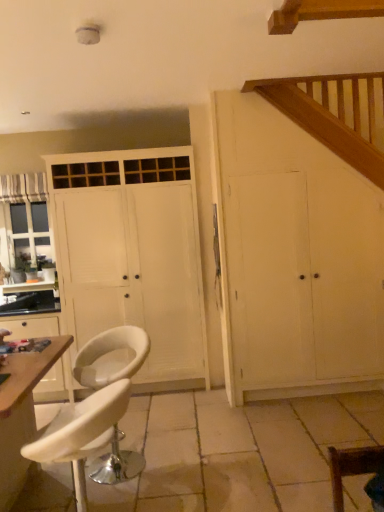
This screenshot has width=384, height=512. What do you see at coordinates (133, 255) in the screenshot?
I see `white matte cabinet at center, which is the 1th cupboard in left-to-right order` at bounding box center [133, 255].

Describe the element at coordinates (81, 433) in the screenshot. I see `white leather stool at lower left, acting as the second chair starting from the back` at that location.

Measure the distance between point (107, 440) and camera.

The distance of point (107, 440) from camera is 1.97 meters.

The image size is (384, 512). What do you see at coordinates (352, 467) in the screenshot?
I see `white leather chair at lower right, which is the 3th chair from left to right` at bounding box center [352, 467].

Locate an element on the screen. This screenshot has width=384, height=512. white wood cupboard at right, the 1th cupboard viewed from the right is located at coordinates (294, 258).

This screenshot has height=512, width=384. What are the coordinates of `matte white cabinet at left` in the screenshot? It's located at click(x=32, y=327).

Looking at this image, measure the distance between point (58, 382) and camera.

The distance of point (58, 382) from camera is 12.72 feet.

This screenshot has height=512, width=384. In order to click on white leather bar stool at lower left, which appears as the first chair when viewed from the left in this screenshot , I will do `click(111, 358)`.

Would you say matte white cabinet at left is to the left or to the right of wooden table at lower left in the picture?

In the image, matte white cabinet at left appears on the left side of wooden table at lower left.

From the image's perspective, is matte white cabinet at left under wooden table at lower left?

No, from the image's perspective, matte white cabinet at left is not below wooden table at lower left.

This screenshot has height=512, width=384. Find the location of `cabinetry above the wooden table at lower left (from a real-world perspective)`. cabinetry above the wooden table at lower left (from a real-world perspective) is located at coordinates (32, 327).

In the image, is matte white cabinet at left positioned in front of or behind wooden table at lower left?

matte white cabinet at left is behind wooden table at lower left.

Considering the sizes of white wood cupboard at right, which ranks as the second cupboard in left-to-right order, and matte white cabinet at left in the image, is white wood cupboard at right, which ranks as the second cupboard in left-to-right order, bigger or smaller than matte white cabinet at left?

Considering their sizes, white wood cupboard at right, which ranks as the second cupboard in left-to-right order, takes up more space than matte white cabinet at left.

Is white wood cupboard at right, the 1th cupboard viewed from the right, oriented towards matte white cabinet at left?

No, white wood cupboard at right, the 1th cupboard viewed from the right, does not turn towards matte white cabinet at left.

In the image, is white wood cupboard at right, the 1th cupboard viewed from the right, positioned in front of or behind matte white cabinet at left?

white wood cupboard at right, the 1th cupboard viewed from the right, is in front of matte white cabinet at left.

Could matte white cabinet at left be considered to be inside white wood cupboard at right, the 1th cupboard viewed from the right?

No, matte white cabinet at left is located outside of white wood cupboard at right, the 1th cupboard viewed from the right.

Based on their sizes in the image, would you say white leather chair at lower right, placed as the 3th chair when sorted from back to front, is bigger or smaller than matte white cabinet at left?

In the image, white leather chair at lower right, placed as the 3th chair when sorted from back to front, appears to be smaller than matte white cabinet at left.

Between white leather chair at lower right, which is the first chair from front to back, and matte white cabinet at left, which one has less height?

white leather chair at lower right, which is the first chair from front to back, is shorter.

What's the angular difference between white leather chair at lower right, which is the first chair from front to back, and matte white cabinet at left's facing directions?

89.5 degrees separate the facing orientations of white leather chair at lower right, which is the first chair from front to back, and matte white cabinet at left.

From the matte white cabinet at left, count 3rd chair to the right and point to it. Please provide its 2D coordinates.

[(352, 467)]

Can you tell me how much white leather bar stool at lower left, arranged as the 1th chair when viewed from the back, and wooden table at lower left differ in facing direction?

The angle between the facing direction of white leather bar stool at lower left, arranged as the 1th chair when viewed from the back, and the facing direction of wooden table at lower left is 121 degrees.

From a real-world perspective, does white leather bar stool at lower left, arranged as the 1th chair when viewed from the back, stand above wooden table at lower left?

No.

From the image's perspective, relative to wooden table at lower left, is white leather bar stool at lower left, arranged as the third chair when viewed from the right, above or below?

Based on their image positions, white leather bar stool at lower left, arranged as the third chair when viewed from the right, is located above wooden table at lower left.

Is white leather bar stool at lower left, arranged as the third chair when viewed from the right, inside the boundaries of wooden table at lower left, or outside?

white leather bar stool at lower left, arranged as the third chair when viewed from the right, is outside wooden table at lower left.

Can you confirm if striped fabric curtain at left is smaller than white leather stool at lower left, the second chair viewed from the right?

Yes.

Which chair is the 2nd one when counting from the right side of the striped fabric curtain at left? Please provide its 2D coordinates.

[(81, 433)]

Who is taller, striped fabric curtain at left or white leather stool at lower left, acting as the second chair starting from the left?

white leather stool at lower left, acting as the second chair starting from the left.

Considering the positions of objects striped fabric curtain at left and white leather stool at lower left, the second chair in the front-to-back sequence, in the image provided, who is more to the right, striped fabric curtain at left or white leather stool at lower left, the second chair in the front-to-back sequence,?

Positioned to the right is white leather stool at lower left, the second chair in the front-to-back sequence.

You are a GUI agent. You are given a task and a screenshot of the screen. Output one action in this format:
    pyautogui.click(x=<x>, y=<y>)
    Task: Click on the cupboard that is the 2nd object above the white leather stool at lower left, the second chair viewed from the right (from a real-world perspective)
    The height and width of the screenshot is (512, 384).
    Given the screenshot: What is the action you would take?
    pyautogui.click(x=133, y=255)

From a real-world perspective, between white leather stool at lower left, the second chair viewed from the right, and white matte cabinet at center, the second cupboard in the right-to-left sequence, who is vertically lower?

white leather stool at lower left, the second chair viewed from the right, is physically lower.

In the scene shown: Could you tell me if white leather stool at lower left, acting as the second chair starting from the back, is turned towards white matte cabinet at center, the second cupboard in the right-to-left sequence?

No, white leather stool at lower left, acting as the second chair starting from the back, is not turned towards white matte cabinet at center, the second cupboard in the right-to-left sequence.

From a real-world perspective, starting from the white leather chair at lower right, placed as the 3th chair when sorted from back to front, which chair is the 1st one below it? Please provide its 2D coordinates.

[(81, 433)]

From the image's perspective, who appears lower, white leather stool at lower left, the second chair in the front-to-back sequence, or white leather chair at lower right, placed as the 3th chair when sorted from back to front?

From the image's view, white leather stool at lower left, the second chair in the front-to-back sequence, is below.

Is white leather stool at lower left, acting as the second chair starting from the back, inside the boundaries of white leather chair at lower right, which is the first chair from front to back, or outside?

white leather stool at lower left, acting as the second chair starting from the back, is not inside white leather chair at lower right, which is the first chair from front to back, it's outside.

Is the position of white leather stool at lower left, acting as the second chair starting from the back, more distant than that of white leather chair at lower right, which is the first chair from front to back?

Yes, white leather stool at lower left, acting as the second chair starting from the back, is further from the camera.

Where is `cabinetry that appears behind the wooden table at lower left`? This screenshot has height=512, width=384. cabinetry that appears behind the wooden table at lower left is located at coordinates (32, 327).

I want to click on cabinetry below the white wood cupboard at right, which ranks as the second cupboard in left-to-right order (from the image's perspective), so click(x=32, y=327).

Looking at the image, which one is located further to white matte cabinet at center, the second cupboard in the right-to-left sequence, white wood cupboard at right, which ranks as the second cupboard in left-to-right order, or striped fabric curtain at left?

Based on the image, striped fabric curtain at left appears to be further to white matte cabinet at center, the second cupboard in the right-to-left sequence.

Looking at the image, which one is located closer to white wood cupboard at right, the 1th cupboard viewed from the right, white leather chair at lower right, placed as the 3th chair when sorted from back to front, or striped fabric curtain at left?

white leather chair at lower right, placed as the 3th chair when sorted from back to front, lies closer to white wood cupboard at right, the 1th cupboard viewed from the right, than the other object.

Estimate the real-world distances between objects in this image. Which object is closer to matte white cabinet at left, white leather chair at lower right, which is the first chair from front to back, or white wood cupboard at right, the 1th cupboard viewed from the right?

Among the two, white wood cupboard at right, the 1th cupboard viewed from the right, is located nearer to matte white cabinet at left.

Looking at the image, which one is located further to wooden table at lower left, white wood cupboard at right, the 1th cupboard viewed from the right, or striped fabric curtain at left?

striped fabric curtain at left is further to wooden table at lower left.

Consider the image. From the image, which object appears to be nearer to matte white cabinet at left, striped fabric curtain at left or white leather stool at lower left, acting as the second chair starting from the back?

Based on the image, striped fabric curtain at left appears to be nearer to matte white cabinet at left.

Estimate the real-world distances between objects in this image. Which object is closer to white leather stool at lower left, the second chair in the front-to-back sequence, white leather chair at lower right, which is the first chair from front to back, or white matte cabinet at center, the second cupboard in the right-to-left sequence?

white leather chair at lower right, which is the first chair from front to back, lies closer to white leather stool at lower left, the second chair in the front-to-back sequence, than the other object.

Looking at the image, which one is located closer to white leather stool at lower left, acting as the second chair starting from the back, wooden table at lower left or white leather bar stool at lower left, arranged as the third chair when viewed from the right?

Among the two, white leather bar stool at lower left, arranged as the third chair when viewed from the right, is located nearer to white leather stool at lower left, acting as the second chair starting from the back.

In the scene shown: When comparing their distances from matte white cabinet at left, does white wood cupboard at right, the 1th cupboard viewed from the right, or wooden table at lower left seem closer?

wooden table at lower left.

At what (x,y) coordinates should I click in order to perform the action: click on chair between white leather stool at lower left, the second chair viewed from the right, and white matte cabinet at center, which is the 1th cupboard in left-to-right order, in the front-back direction. Please return your answer as a coordinate pair (x, y). The width and height of the screenshot is (384, 512). Looking at the image, I should click on (111, 358).

The width and height of the screenshot is (384, 512). I want to click on cupboard located between wooden table at lower left and white matte cabinet at center, which is the 1th cupboard in left-to-right order, in the depth direction, so click(294, 258).

This screenshot has height=512, width=384. In order to click on chair positioned between white leather stool at lower left, the second chair in the front-to-back sequence, and matte white cabinet at left from near to far in this screenshot , I will do [x=111, y=358].

Locate an element on the screen. This screenshot has height=512, width=384. chair positioned between wooden table at lower left and matte white cabinet at left from near to far is located at coordinates (111, 358).